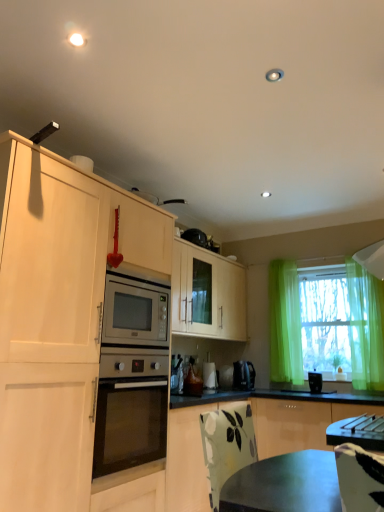
Image resolution: width=384 pixels, height=512 pixels. Find the location of `free space above green sheer curtain at right (from a real-world perspective)`. free space above green sheer curtain at right (from a real-world perspective) is located at coordinates (367, 247).